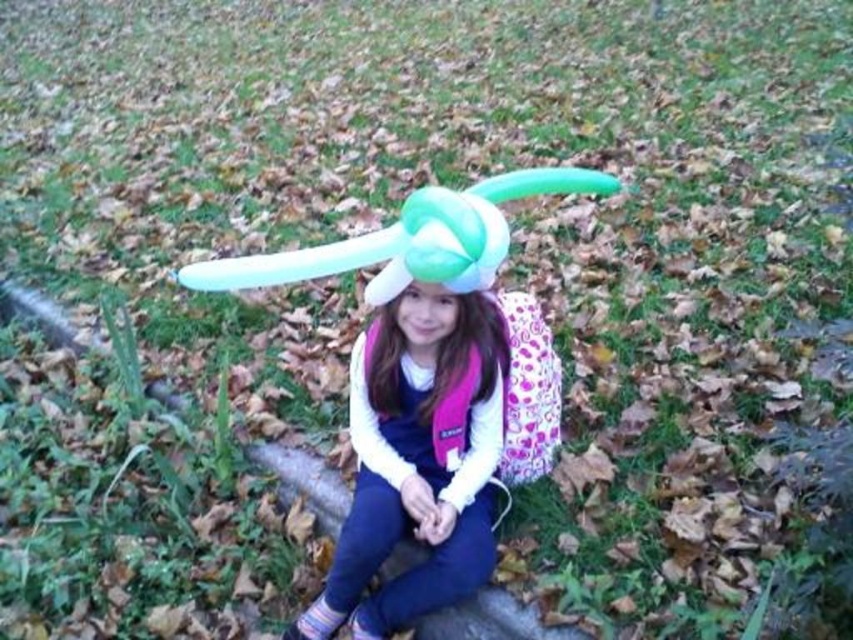
Question: Can you confirm if matte white balloon at center is positioned above translucent plastic balloon at center?

Choices:
 (A) no
 (B) yes

Answer: (A)

Question: Can you confirm if matte white balloon at center is thinner than translucent plastic balloon at center?

Choices:
 (A) no
 (B) yes

Answer: (A)

Question: Is matte white balloon at center behind translucent plastic balloon at center?

Choices:
 (A) no
 (B) yes

Answer: (A)